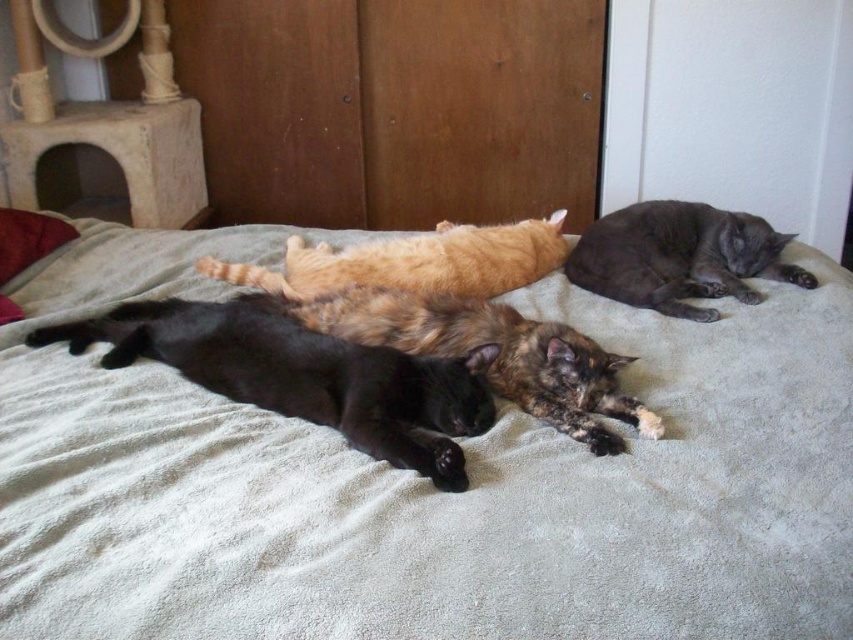
Can you confirm if tortoiseshell fur cat at center is thinner than velvety red pillow at left?

No.

Who is shorter, tortoiseshell fur cat at center or velvety red pillow at left?

With less height is velvety red pillow at left.

Which is in front, point (589, 381) or point (51, 241)?

Point (589, 381)

Locate an element on the screen. tortoiseshell fur cat at center is located at coordinates (497, 356).

Between point (780, 621) and point (45, 221), which one is positioned behind?

Point (45, 221)

Can you confirm if soft gray blanket at center is positioned below velvety red pillow at left?

Yes.

Does point (277, 522) come in front of point (56, 246)?

Yes, point (277, 522) is in front of point (56, 246).

Locate an element on the screen. soft gray blanket at center is located at coordinates (425, 483).

Is soft gray blanket at center to the right of orange fur cat at center from the viewer's perspective?

No, soft gray blanket at center is not to the right of orange fur cat at center.

This screenshot has height=640, width=853. Identify the location of soft gray blanket at center. (425, 483).

Identify the location of soft gray blanket at center. (425, 483).